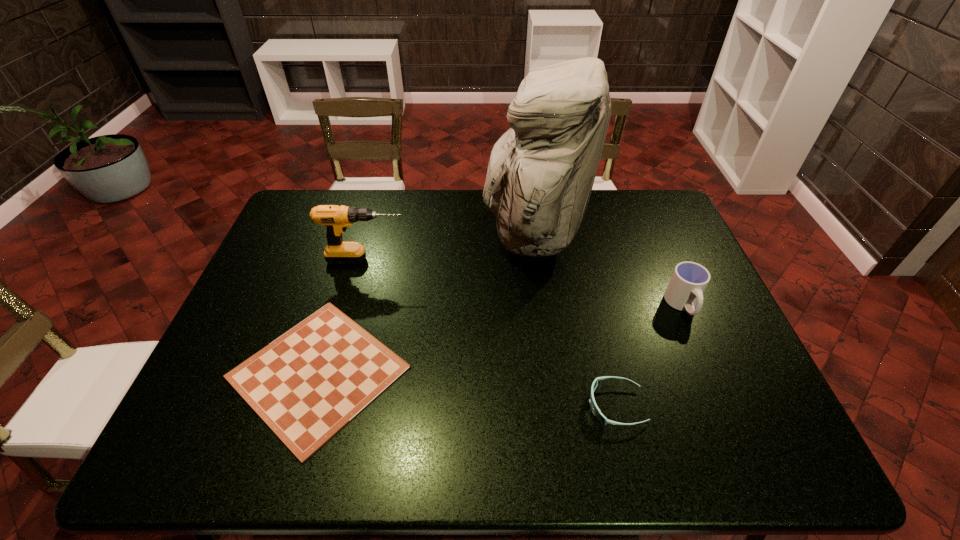
At what (x,y) coordinates should I click in order to perform the action: click on vacant space located 0.210m with the handle on the side of the rightmost object. Please return your answer as a coordinate pair (x, y). Looking at the image, I should click on (720, 392).

Where is `vacant space located on the front-facing side of the second shortest object`? The width and height of the screenshot is (960, 540). vacant space located on the front-facing side of the second shortest object is located at coordinates (468, 406).

Find the location of a particular element. This screenshot has width=960, height=540. free space located on the front-facing side of the second shortest object is located at coordinates (438, 406).

Locate an element on the screen. The height and width of the screenshot is (540, 960). free space located on the front-facing side of the second shortest object is located at coordinates (563, 406).

This screenshot has height=540, width=960. Find the location of `free space located on the right of the checkerboard`. free space located on the right of the checkerboard is located at coordinates (564, 372).

Find the location of `object that is positioned at the far edge`. object that is positioned at the far edge is located at coordinates (541, 171).

I want to click on goggles located in the near edge section of the desktop, so click(x=596, y=411).

Locate an element on the screen. The height and width of the screenshot is (540, 960). checkerboard that is positioned at the near edge is located at coordinates (308, 384).

Locate an element on the screen. This screenshot has height=540, width=960. object that is at the left edge is located at coordinates (308, 384).

This screenshot has width=960, height=540. I want to click on object that is at the right edge, so click(689, 280).